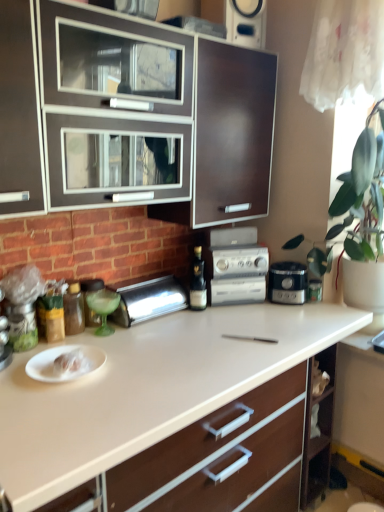
Find the location of a particular element. unoccupied region to the right of white paper plate at lower left is located at coordinates (118, 377).